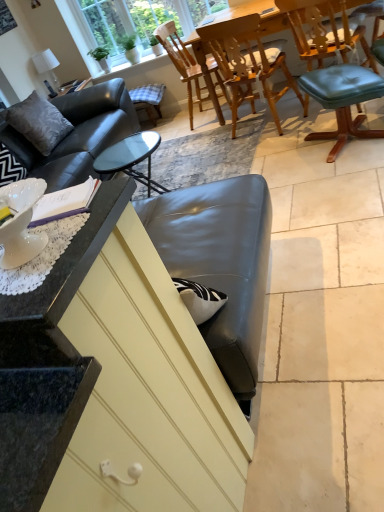
Question: Is wooden chair at center, placed as the second chair when sorted from right to left, at the right side of teak wood dining table at center?

Choices:
 (A) no
 (B) yes

Answer: (A)

Question: Is wooden chair at center, placed as the second chair when sorted from right to left, positioned far away from teak wood dining table at center?

Choices:
 (A) no
 (B) yes

Answer: (A)

Question: Does wooden chair at center, marked as the second chair in a left-to-right arrangement, have a lesser width compared to teak wood dining table at center?

Choices:
 (A) yes
 (B) no

Answer: (A)

Question: From a real-world perspective, does wooden chair at center, marked as the second chair in a left-to-right arrangement, stand above teak wood dining table at center?

Choices:
 (A) yes
 (B) no

Answer: (A)

Question: Considering the relative sizes of wooden chair at center, marked as the second chair in a left-to-right arrangement, and teak wood dining table at center in the image provided, is wooden chair at center, marked as the second chair in a left-to-right arrangement, taller than teak wood dining table at center?

Choices:
 (A) no
 (B) yes

Answer: (B)

Question: In terms of height, does wooden chair at center, placed as the second chair when sorted from right to left, look taller or shorter compared to teal leather chair at right, the 1th chair viewed from the right?

Choices:
 (A) tall
 (B) short

Answer: (A)

Question: Does point (251, 95) appear closer or farther from the camera than point (357, 36)?

Choices:
 (A) closer
 (B) farther

Answer: (B)

Question: Based on their positions, is wooden chair at center, marked as the second chair in a left-to-right arrangement, located to the left or right of teal leather chair at right, the 1th chair viewed from the right?

Choices:
 (A) left
 (B) right

Answer: (A)

Question: From the image's perspective, is wooden chair at center, marked as the second chair in a left-to-right arrangement, above or below teal leather chair at right, placed as the third chair when sorted from left to right?

Choices:
 (A) above
 (B) below

Answer: (B)

Question: Is point (148, 83) closer or farther from the camera than point (218, 33)?

Choices:
 (A) farther
 (B) closer

Answer: (A)

Question: Relative to wooden chair at center, placed as the second chair when sorted from right to left, is plaid fabric bar stool at center, which is the first bar stool in top-to-bottom order, in front or behind?

Choices:
 (A) behind
 (B) front

Answer: (A)

Question: From the image's perspective, is plaid fabric bar stool at center, which is the first bar stool in top-to-bottom order, located above or below wooden chair at center, placed as the second chair when sorted from right to left?

Choices:
 (A) below
 (B) above

Answer: (B)

Question: In terms of width, does plaid fabric bar stool at center, which is the first bar stool in top-to-bottom order, look wider or thinner when compared to wooden chair at center, placed as the second chair when sorted from right to left?

Choices:
 (A) wide
 (B) thin

Answer: (B)

Question: Considering their positions, is gray suede pillow at upper left located in front of or behind black granite countertop at left?

Choices:
 (A) behind
 (B) front

Answer: (A)

Question: Is gray suede pillow at upper left to the left or to the right of black granite countertop at left in the image?

Choices:
 (A) right
 (B) left

Answer: (B)